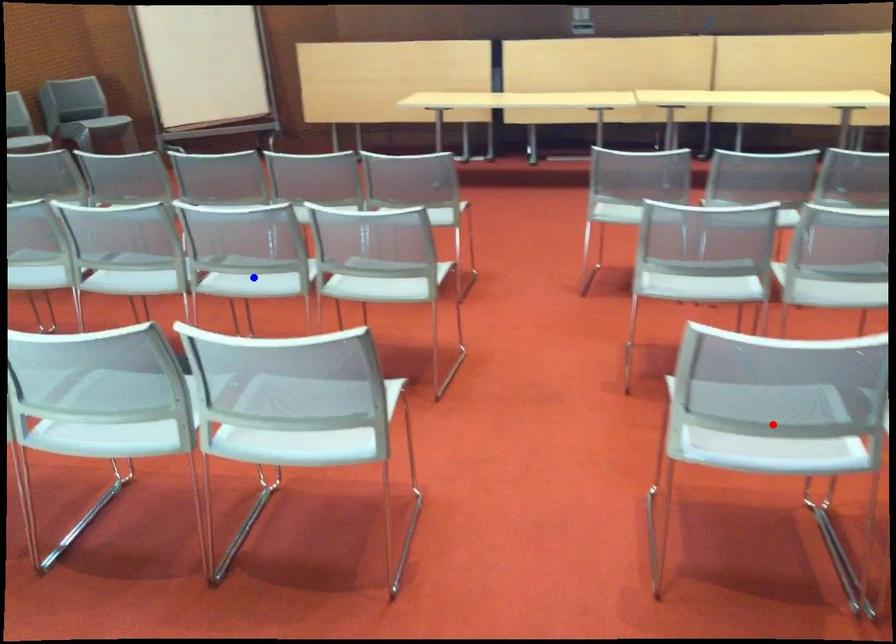
Question: Two points are marked on the image. Which point is closer to the camera?

Choices:
 (A) Blue point is closer.
 (B) Red point is closer.

Answer: (B)